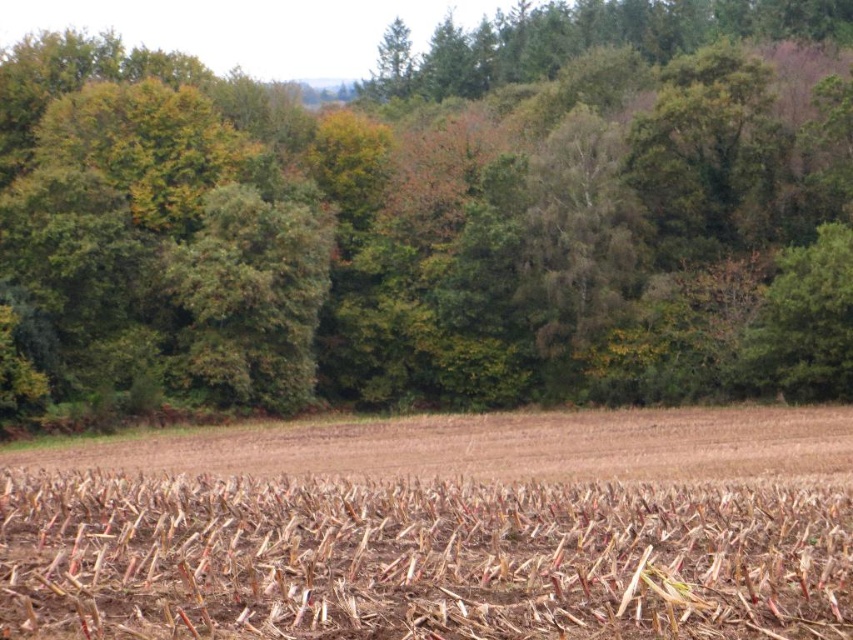
Question: Which object appears farthest from the camera in this image?

Choices:
 (A) green matte tree at center
 (B) brown dry stalks at center

Answer: (A)

Question: Can you confirm if green matte tree at center is thinner than brown dry stalks at center?

Choices:
 (A) no
 (B) yes

Answer: (A)

Question: Which of the following is the farthest from the observer?

Choices:
 (A) brown dry stalks at center
 (B) green matte tree at center

Answer: (B)

Question: Does green matte tree at center have a larger size compared to brown dry stalks at center?

Choices:
 (A) no
 (B) yes

Answer: (B)

Question: Among these points, which one is nearest to the camera?

Choices:
 (A) (442, 598)
 (B) (204, 204)

Answer: (A)

Question: Does green matte tree at center appear under brown dry stalks at center?

Choices:
 (A) yes
 (B) no

Answer: (B)